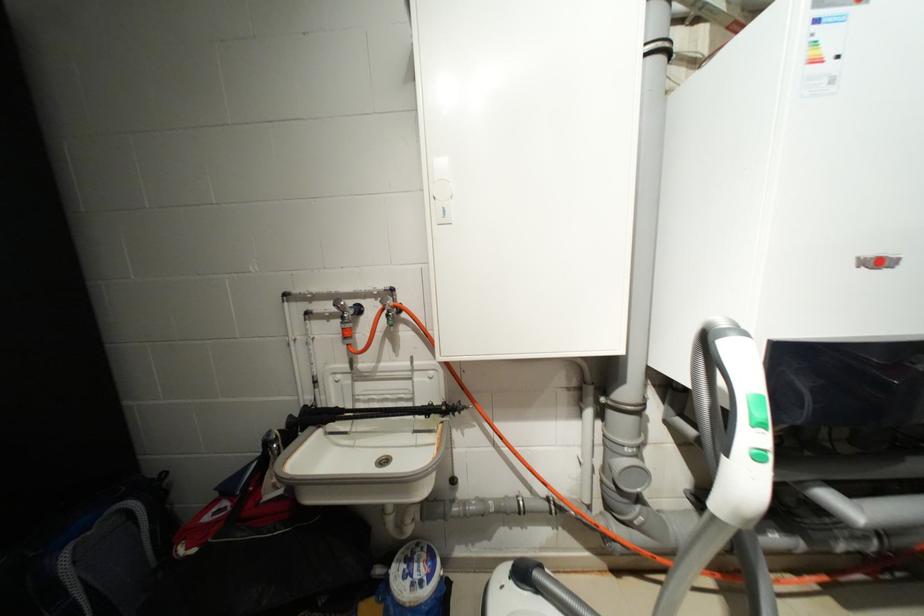
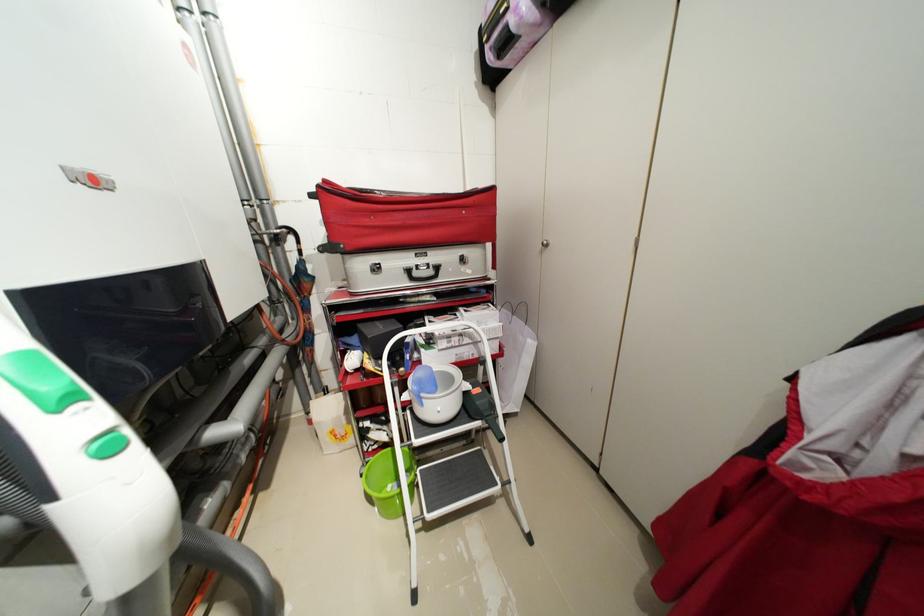
How did the camera likely rotate?

The rotation direction of the camera is right-down.